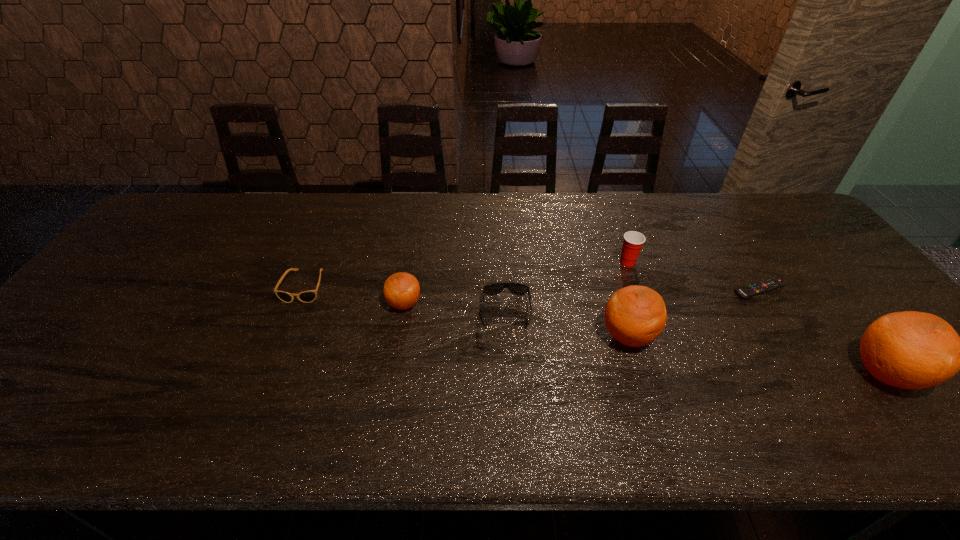
The height and width of the screenshot is (540, 960). Identify the location of vacant space at the far edge. (567, 213).

At what (x,y) coordinates should I click in order to perform the action: click on free space at the near edge. Please return your answer as a coordinate pair (x, y). The image size is (960, 540). Looking at the image, I should click on (818, 367).

Locate an element on the screen. vacant region at the right edge of the desktop is located at coordinates (878, 312).

This screenshot has width=960, height=540. In order to click on free space at the far left corner of the desktop in this screenshot , I will do `click(216, 206)`.

Locate an element on the screen. The height and width of the screenshot is (540, 960). vacant space at the far right corner of the desktop is located at coordinates (772, 228).

You are a GUI agent. You are given a task and a screenshot of the screen. Output one action in this format:
    pyautogui.click(x=<x>, y=<y>)
    Task: Click on the vacant area that lies between the remote control and the second tallest object
    The image size is (960, 540).
    Given the screenshot: What is the action you would take?
    pyautogui.click(x=693, y=313)

Identify the location of vacant area that lies between the rightmost object and the right sunglasses. coord(696,342).

At what (x,y) coordinates should I click in order to perform the action: click on blank region between the left sunglasses and the shortest orange. Please return your answer as a coordinate pair (x, y). This screenshot has width=960, height=540. Looking at the image, I should click on (354, 295).

Locate an element on the screen. Image resolution: width=960 pixels, height=540 pixels. free space between the shortest orange and the leftmost object is located at coordinates tap(354, 295).

Locate an element on the screen. free spot between the second orange from right to left and the rightmost orange is located at coordinates (756, 355).